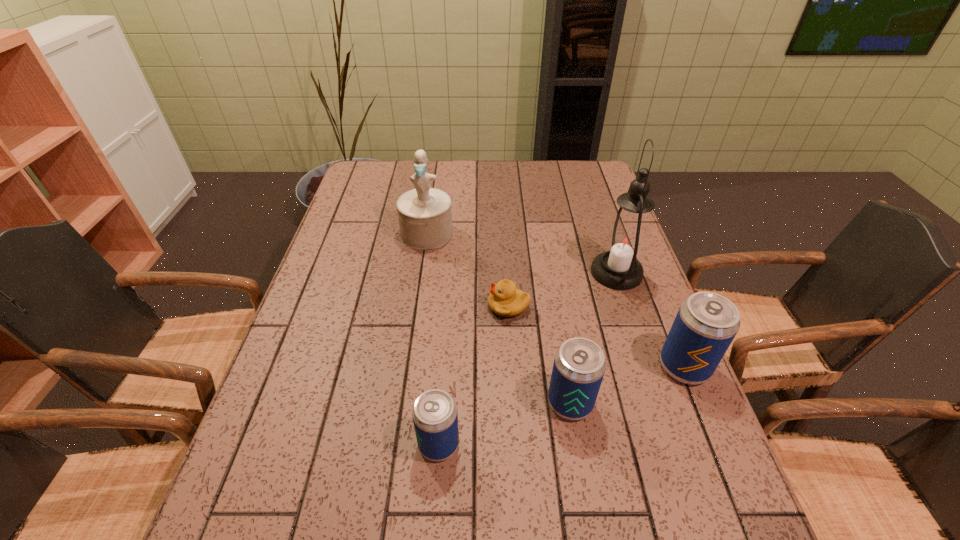
Point out which beer can is positioned as the nearest to the tallest object. Please provide its 2D coordinates. Your answer should be formatted as a tuple, i.e. [(x, y)], where the tuple contains the x and y coordinates of a point satisfying the conditions above.

[(706, 323)]

This screenshot has width=960, height=540. I want to click on free space that satisfies the following two spatial constraints: 1. at the beak of the fifth tallest object; 2. on the right side of the farthest object, so pyautogui.click(x=396, y=444).

Where is `free spot that satisfies the following two spatial constraints: 1. on the back side of the oil lamp; 2. on the right side of the third shortest object`? This screenshot has width=960, height=540. free spot that satisfies the following two spatial constraints: 1. on the back side of the oil lamp; 2. on the right side of the third shortest object is located at coordinates (548, 273).

Locate an element on the screen. This screenshot has height=540, width=960. free region that satisfies the following two spatial constraints: 1. on the back side of the nearest beer can; 2. on the left side of the rightmost beer can is located at coordinates pyautogui.click(x=444, y=367).

You are a GUI agent. You are given a task and a screenshot of the screen. Output one action in this format:
    pyautogui.click(x=<x>, y=<y>)
    Task: Click on the free location that satisfies the following two spatial constraints: 1. on the front-facing side of the third object from left to right; 2. on the left side of the rightmost beer can
    The width and height of the screenshot is (960, 540).
    Given the screenshot: What is the action you would take?
    513,367

This screenshot has height=540, width=960. I want to click on free point that satisfies the following two spatial constraints: 1. at the beak of the nearest object; 2. on the left side of the second tallest object, so click(396, 444).

Identify the location of free space that satisfies the following two spatial constraints: 1. on the front-facing side of the duckling; 2. on the back side of the rightmost beer can. This screenshot has height=540, width=960. point(513,367).

You are a GUI agent. You are given a task and a screenshot of the screen. Output one action in this format:
    pyautogui.click(x=<x>, y=<y>)
    Task: Click on the vacant region that satisfies the following two spatial constraints: 1. on the front side of the tallest object; 2. on the front-facing side of the duckling
    Image resolution: width=960 pixels, height=540 pixels.
    Given the screenshot: What is the action you would take?
    pyautogui.click(x=628, y=306)

At what (x,y) coordinates should I click in order to perform the action: click on vacant space that satisfies the following two spatial constraints: 1. on the back side of the second beer can from right to left; 2. on the left side of the shortest beer can. Please return your answer as a coordinate pair (x, y). Looking at the image, I should click on (442, 402).